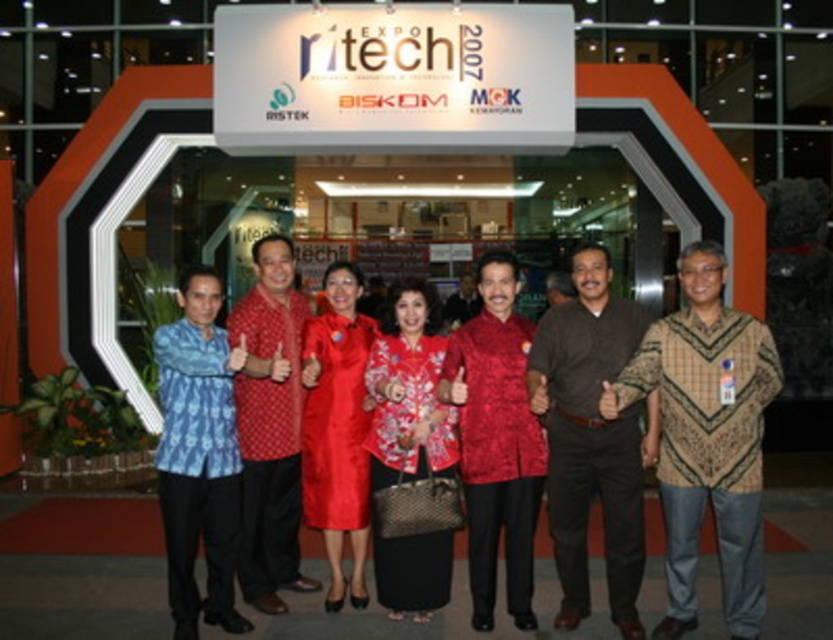
Is brown cotton shirt at center taller than blue batik shirt at center?

Indeed, brown cotton shirt at center has a greater height compared to blue batik shirt at center.

Is brown cotton shirt at center to the left of blue batik shirt at center from the viewer's perspective?

In fact, brown cotton shirt at center is to the right of blue batik shirt at center.

Locate an element on the screen. brown cotton shirt at center is located at coordinates (592, 438).

Identify the location of brown cotton shirt at center. (592, 438).

Who is taller, brown batik shirt at center or embroidered silk dress at center?

brown batik shirt at center is taller.

Describe the element at coordinates (706, 438) in the screenshot. I see `brown batik shirt at center` at that location.

Is point (742, 419) closer to camera compared to point (440, 600)?

Yes.

Locate an element on the screen. Image resolution: width=833 pixels, height=640 pixels. brown batik shirt at center is located at coordinates (706, 438).

Which is more to the right, brown batik shirt at center or shiny red fabric shirt at center?

Positioned to the right is brown batik shirt at center.

Is brown batik shirt at center taller than shiny red fabric shirt at center?

Correct, brown batik shirt at center is much taller as shiny red fabric shirt at center.

From the picture: Who is more forward, [759,438] or [537,424]?

Point [759,438] is in front.

The image size is (833, 640). In order to click on brown batik shirt at center in this screenshot , I will do `click(706, 438)`.